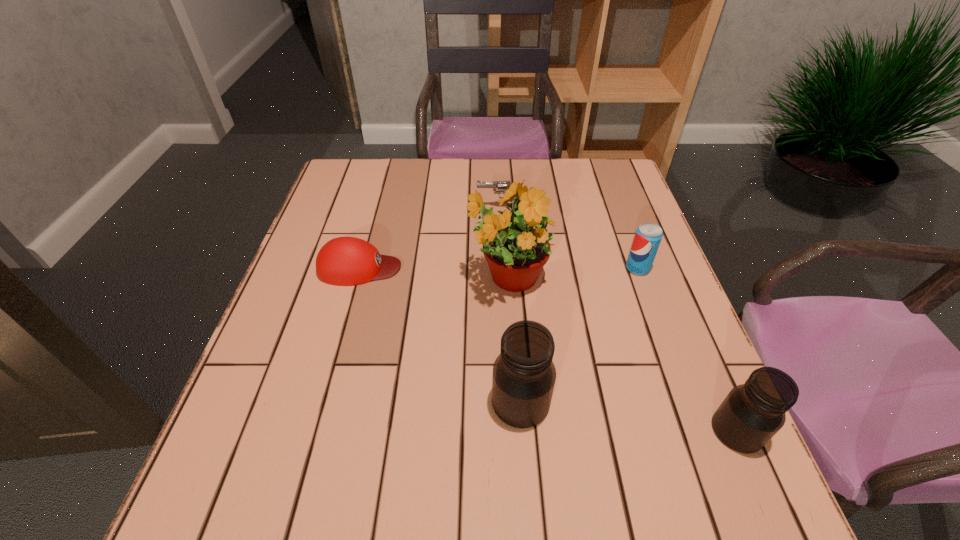
Image resolution: width=960 pixels, height=540 pixels. I want to click on vacant area located at the barrel of the pistol, so click(334, 207).

Where is `free space located 0.300m at the barrel of the pistol`? The width and height of the screenshot is (960, 540). free space located 0.300m at the barrel of the pistol is located at coordinates (370, 207).

Locate an element on the screen. This screenshot has height=540, width=960. vacant region located 0.320m at the barrel of the pistol is located at coordinates coord(363,207).

Identify the location of free spot located 0.050m on the front-facing side of the leftmost object. Image resolution: width=960 pixels, height=540 pixels. (422, 268).

Where is `vacant space positioned on the back of the fourth tallest object`? vacant space positioned on the back of the fourth tallest object is located at coordinates (606, 179).

At what (x,y) coordinates should I click in order to perform the action: click on vacant space located on the back of the tallest object. Please return your answer as a coordinate pair (x, y). Image resolution: width=960 pixels, height=540 pixels. Looking at the image, I should click on (501, 187).

Locate an element on the screen. This screenshot has width=960, height=540. object that is positioned at the left edge is located at coordinates point(346,261).

You are a GUI agent. You are given a task and a screenshot of the screen. Output one action in this format:
    pyautogui.click(x=<x>, y=<y>)
    Task: Click on the jar positioned at the right edge
    This screenshot has width=960, height=540.
    Given the screenshot: What is the action you would take?
    pyautogui.click(x=751, y=414)

At what (x,y) coordinates should I click in order to perform the action: click on soda can situated at the right edge. Please return your answer as a coordinate pair (x, y). The image size is (960, 540). Looking at the image, I should click on (648, 236).

Find the location of a particular element. object situated at the near right corner is located at coordinates (751, 414).